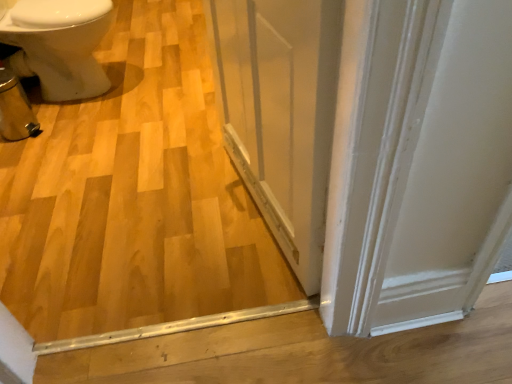
Question: From a real-world perspective, is natural wood floor at center above or below transparent glass screen door at center?

Choices:
 (A) below
 (B) above

Answer: (A)

Question: From the image's perspective, is natural wood floor at center above or below transparent glass screen door at center?

Choices:
 (A) above
 (B) below

Answer: (A)

Question: Which object is the closest to the transparent glass screen door at center?

Choices:
 (A) natural wood floor at center
 (B) white glossy bidet at left

Answer: (A)

Question: Considering the real-world distances, which object is farthest from the transparent glass screen door at center?

Choices:
 (A) white glossy bidet at left
 (B) natural wood floor at center

Answer: (A)